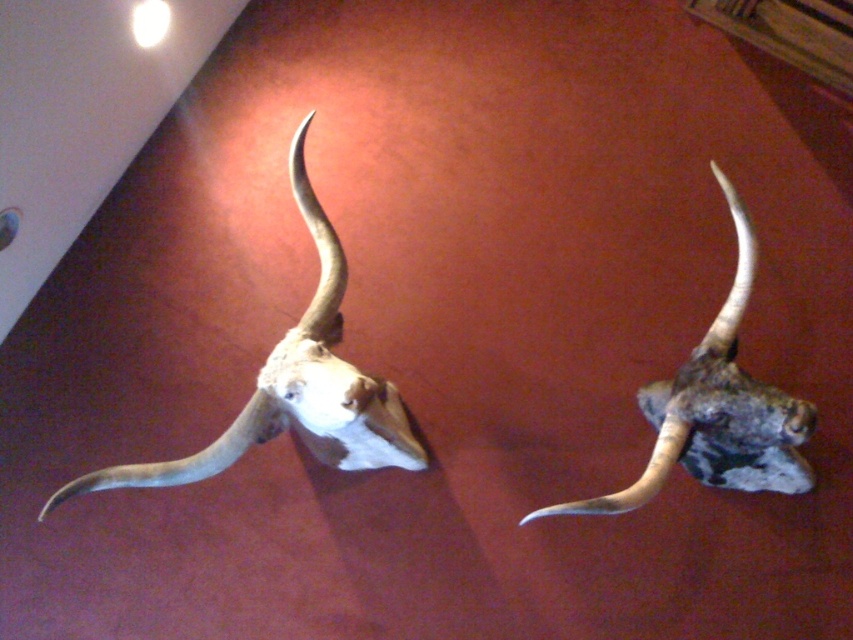
Does white bone skull at center appear over rustic wood moose head at right?

Indeed, white bone skull at center is positioned over rustic wood moose head at right.

From the picture: Who is more distant from viewer, (305, 321) or (770, 484)?

Positioned behind is point (770, 484).

Between point (231, 426) and point (718, 180), which one is positioned in front?

Point (231, 426)

Locate an element on the screen. white bone skull at center is located at coordinates (294, 387).